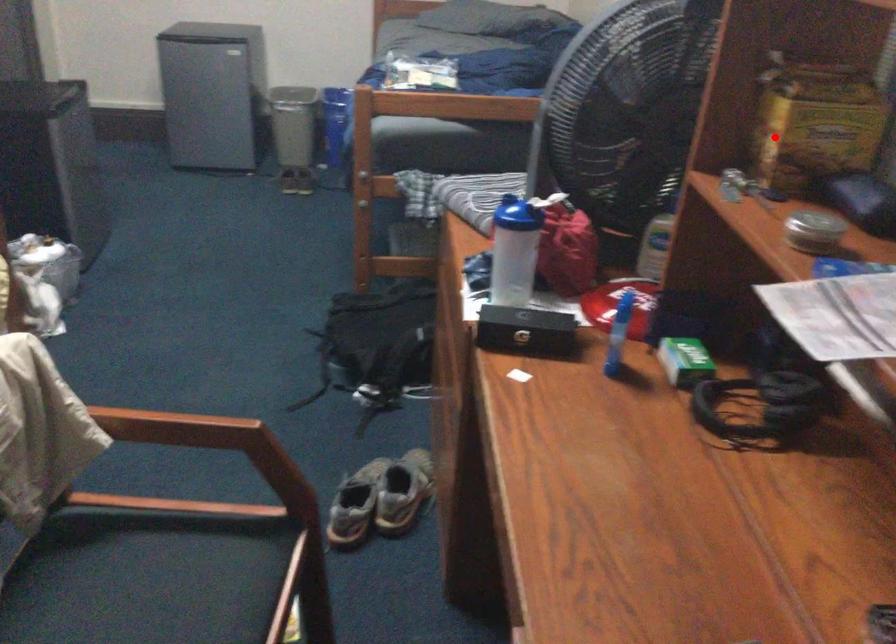
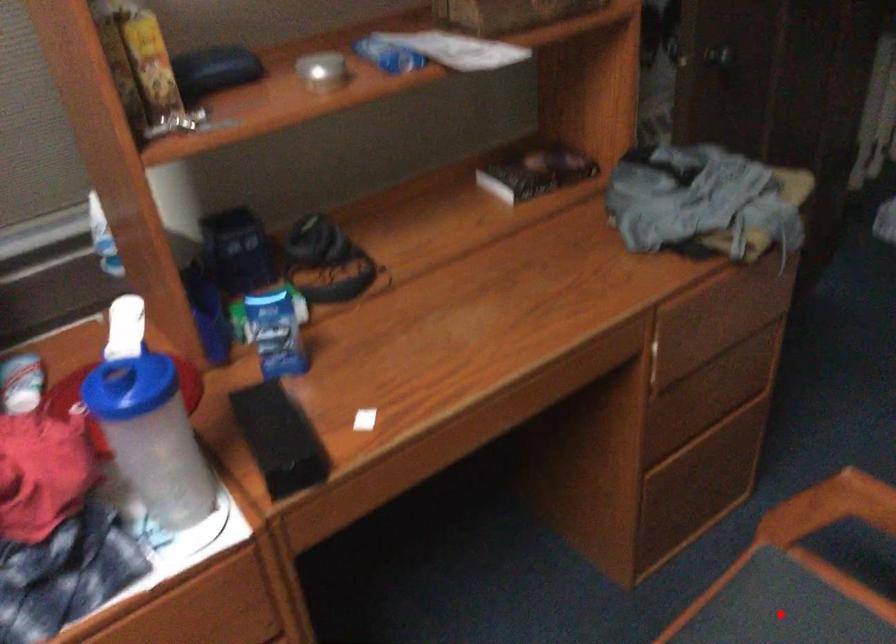
I am providing you with two images of the same scene from different viewpoints. A red point is marked on the first image and another point is marked on the second image. Is the red point in image1 aligned with the point shown in image2?

No